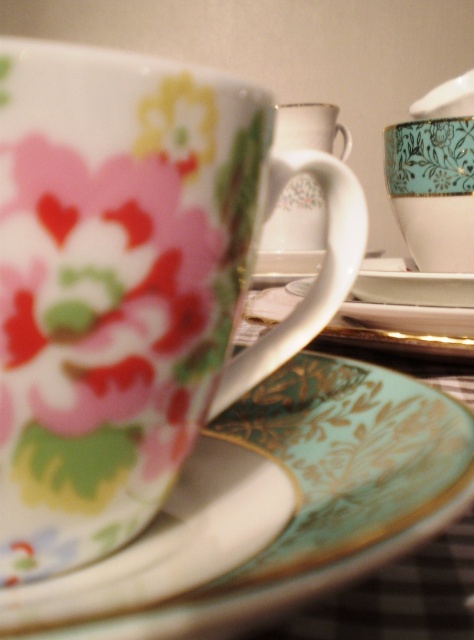
Is point (394, 372) positioned in front of point (327, 125)?

Yes, point (394, 372) is in front of point (327, 125).

Can you confirm if teal floral plate at center is positioned to the right of porcelain floral mug at center?

In fact, teal floral plate at center is to the left of porcelain floral mug at center.

Locate an element on the screen. The image size is (474, 640). teal floral plate at center is located at coordinates tap(307, 493).

How distant is teal floral plate at center from teal glossy saucer at center?

2.26 centimeters

Does teal floral plate at center appear under teal glossy saucer at center?

Actually, teal floral plate at center is above teal glossy saucer at center.

At what (x,y) coordinates should I click in order to perform the action: click on teal floral plate at center. Please return your answer as a coordinate pair (x, y). The width and height of the screenshot is (474, 640). Looking at the image, I should click on (307, 493).

Is turquoise glossy mug at upper center to the right of porcelain floral mug at center from the viewer's perspective?

Indeed, turquoise glossy mug at upper center is positioned on the right side of porcelain floral mug at center.

Which is below, turquoise glossy mug at upper center or porcelain floral mug at center?

turquoise glossy mug at upper center is below.

The height and width of the screenshot is (640, 474). Describe the element at coordinates (433, 189) in the screenshot. I see `turquoise glossy mug at upper center` at that location.

Find the location of a particular element. The width and height of the screenshot is (474, 640). turquoise glossy mug at upper center is located at coordinates (433, 189).